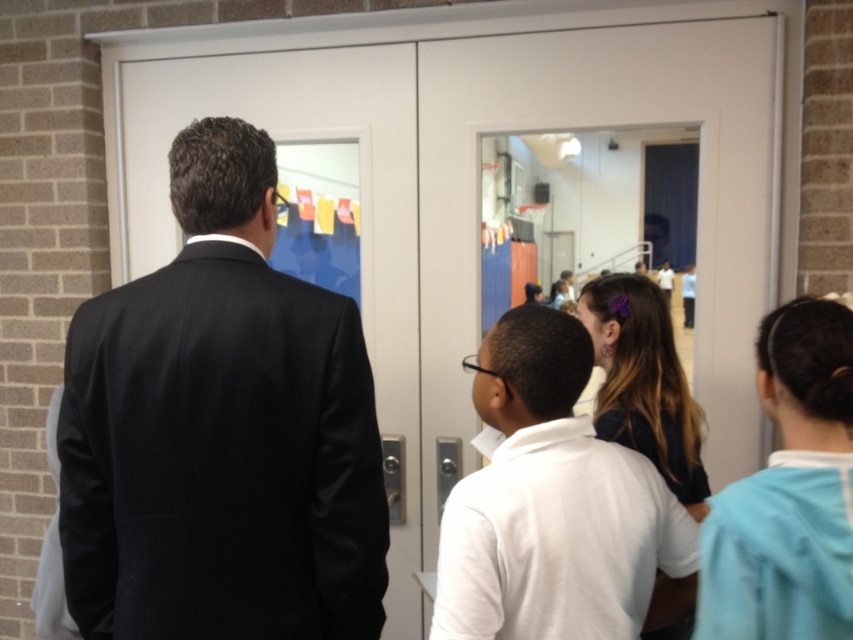
Question: Does black suit at left appear on the left side of dark brown hair at center?

Choices:
 (A) no
 (B) yes

Answer: (B)

Question: Which point is farther to the camera?

Choices:
 (A) (778, 579)
 (B) (628, 296)

Answer: (B)

Question: Does white matte shirt at center have a smaller size compared to light blue fabric at right?

Choices:
 (A) yes
 (B) no

Answer: (B)

Question: Which object is farther from the camera taking this photo?

Choices:
 (A) light blue fabric at right
 (B) dark brown hair at center
 (C) black suit at left
 (D) white matte shirt at center

Answer: (B)

Question: Does black suit at left appear on the right side of light blue fabric at right?

Choices:
 (A) yes
 (B) no

Answer: (B)

Question: Which is nearer to the light blue fabric at right?

Choices:
 (A) black suit at left
 (B) dark brown hair at center
 (C) white matte shirt at center

Answer: (C)